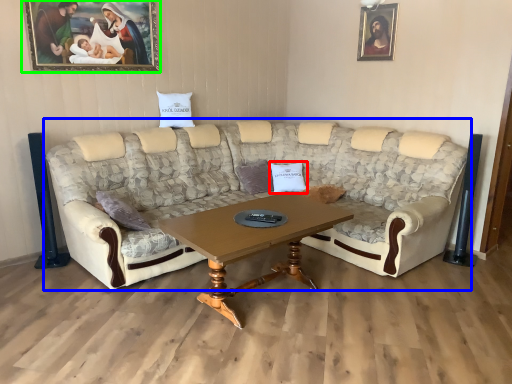
Question: Estimate the real-world distances between objects in this image. Which object is farther from pillow (highlighted by a red box), studio couch (highlighted by a blue box) or picture frame (highlighted by a green box)?

Choices:
 (A) studio couch
 (B) picture frame

Answer: (B)